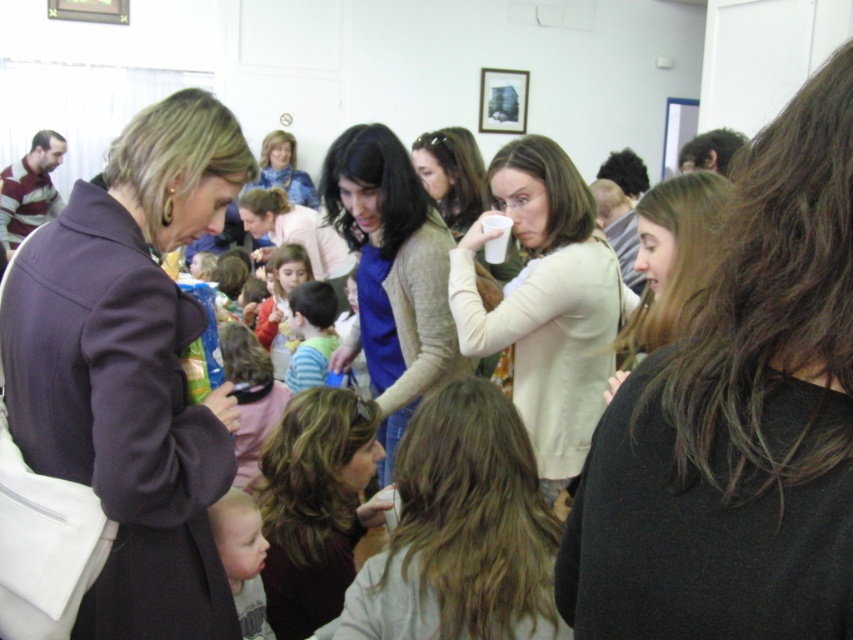
You are at a social event and notice two sweaters at the center of the room. The knit sweater at center and the red sweater at center. Which one is nearer to you?

The knit sweater at center is closer to the viewer than the red sweater at center.

You are standing in the room and want to move towards the two points marked in the scene. Which point, point (250,618) or point (271,326), is closer to you?

Point (250,618) is closer to the viewer than point (271,326).

You are organizing a clothing donation drive and need to categorize the knit sweater at center and the red sweater at center based on their sizes. Which sweater should be placed in the large size bin?

Result: The knit sweater at center should be placed in the large size bin because it is larger in size than the red sweater at center.